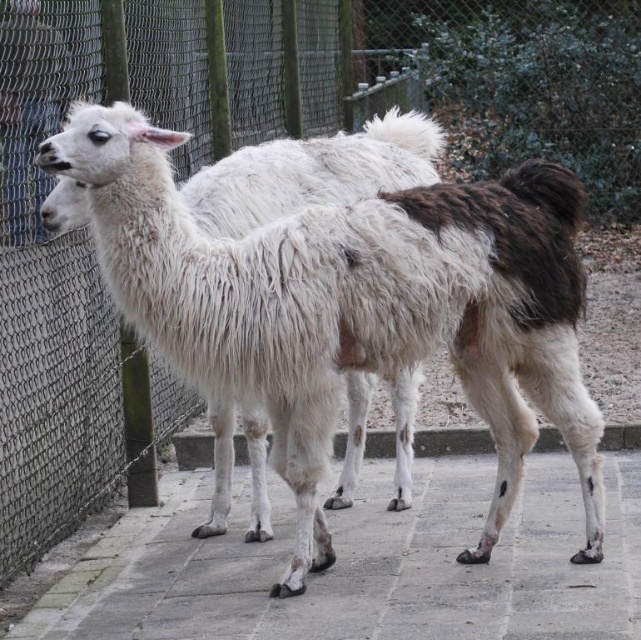
Is white woolly alpaca at center bigger than gray concrete pavement at center?

Indeed, white woolly alpaca at center has a larger size compared to gray concrete pavement at center.

Can you confirm if white woolly alpaca at center is taller than gray concrete pavement at center?

Yes.

Find the location of `white woolly alpaca at center`. white woolly alpaca at center is located at coordinates (353, 305).